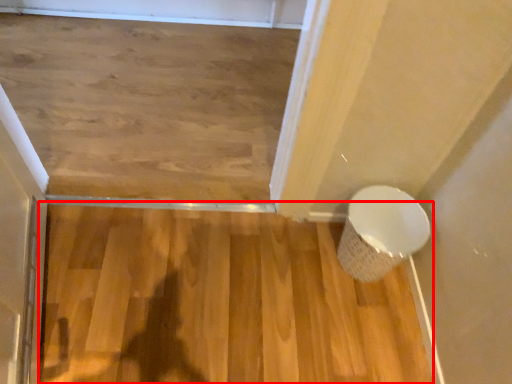
Question: From the image's perspective, what is the correct spatial positioning of hardwood (annotated by the red box) in reference to toilet?

Choices:
 (A) above
 (B) below

Answer: (B)